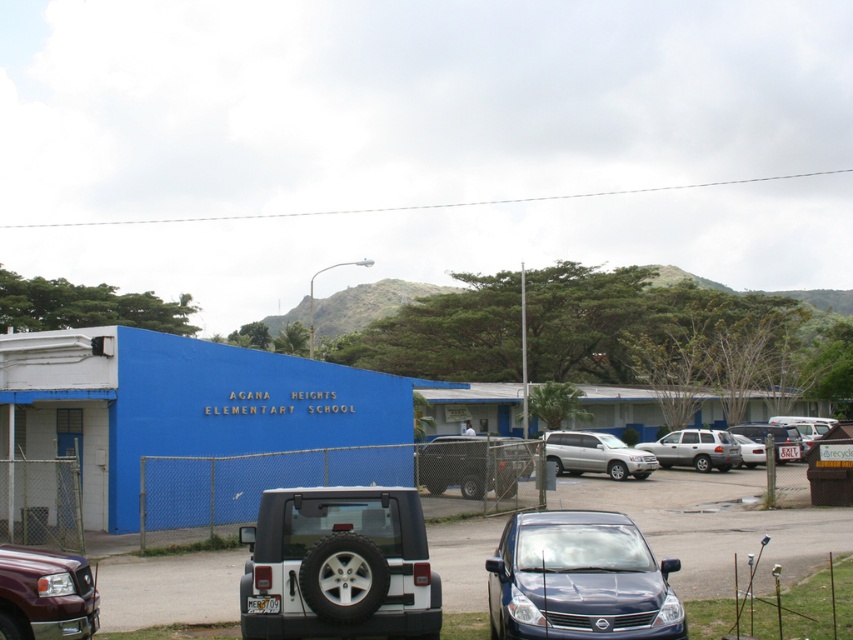
You are standing in front of Agana Heights Elementary School and see the metallic silver car at center and the glossy blue car at center in the parking lot. Which car is positioned to the right side of the other?

The metallic silver car at center is positioned to the right of the glossy blue car at center.

You are a delivery person who needs to park your 6.5 feet tall van. You see the metallic silver car at center and the glossy blue car at center in the parking lot. Can your van fit in the parking space between them?

The metallic silver car at center is taller than the glossy blue car at center. Since your van is 6.5 feet tall, it depends on the height of the space between the two cars. However, since the silver car is taller, the available vertical space might be limited. Without exact measurements, it is uncertain if the van will fit.